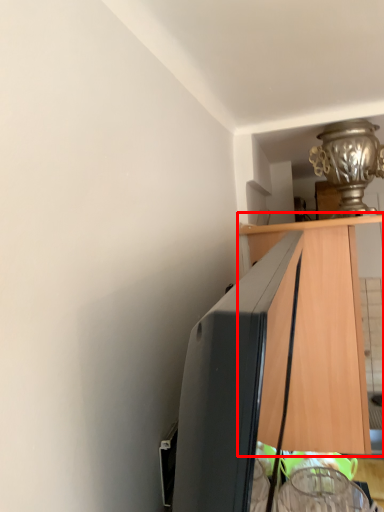
Question: From the image's perspective, what is the correct spatial positioning of cabinetry (annotated by the red box) in reference to lamp?

Choices:
 (A) below
 (B) above

Answer: (A)